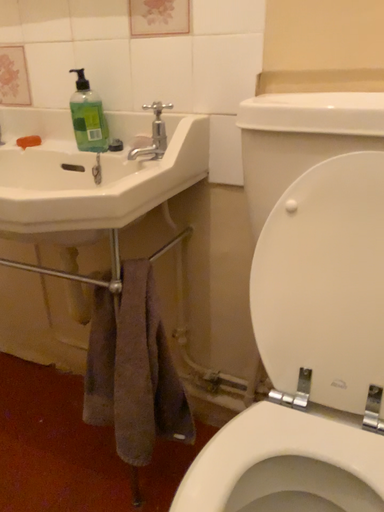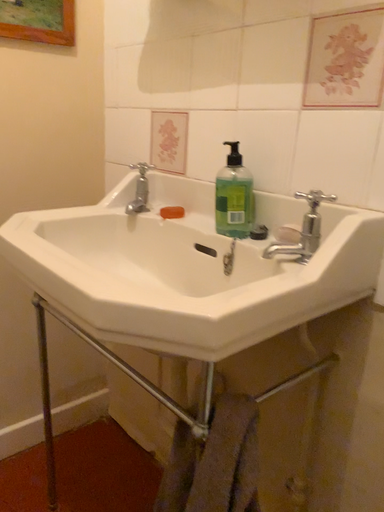
Question: How did the camera likely rotate when shooting the video?

Choices:
 (A) rotated downward
 (B) rotated upward

Answer: (B)